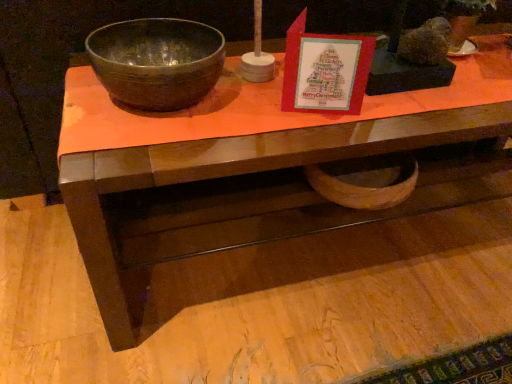
Find the location of a particular element. This screenshot has height=384, width=512. wooden desk at center is located at coordinates (249, 196).

What do you see at coordinates (249, 196) in the screenshot?
I see `wooden desk at center` at bounding box center [249, 196].

Measure the distance between point (170,71) and camera.

They are 27.24 inches apart.

Describe the element at coordinates (157, 62) in the screenshot. I see `matte brown bowl at left` at that location.

Locate an element on the screen. The width and height of the screenshot is (512, 384). matte brown bowl at left is located at coordinates (157, 62).

Locate an element on the screen. This screenshot has height=384, width=512. wooden desk at center is located at coordinates (249, 196).

Can you confirm if wooden desk at center is positioned to the right of matte brown bowl at left?

Yes.

Which object is closer to the camera taking this photo, wooden desk at center or matte brown bowl at left?

Positioned in front is wooden desk at center.

Considering the positions of point (124, 169) and point (215, 35), is point (124, 169) closer or farther from the camera than point (215, 35)?

Clearly, point (124, 169) is closer to the camera than point (215, 35).

From the image's perspective, who appears lower, wooden desk at center or matte brown bowl at left?

wooden desk at center, from the image's perspective.

From a real-world perspective, which object rests below the other?

wooden desk at center, from a real-world perspective.

Considering the relative sizes of wooden desk at center and matte brown bowl at left in the image provided, is wooden desk at center wider than matte brown bowl at left?

Yes, wooden desk at center is wider than matte brown bowl at left.

Considering the sizes of wooden desk at center and matte brown bowl at left in the image, is wooden desk at center taller or shorter than matte brown bowl at left?

In the image, wooden desk at center appears to be taller than matte brown bowl at left.

Who is bigger, wooden desk at center or matte brown bowl at left?

Bigger between the two is wooden desk at center.

Would you say wooden desk at center contains matte brown bowl at left?

That's incorrect, matte brown bowl at left is not inside wooden desk at center.

Are wooden desk at center and matte brown bowl at left far apart?

No.

Looking at this image, is wooden desk at center positioned with its back to matte brown bowl at left?

wooden desk at center does not have its back to matte brown bowl at left.

How much distance is there between wooden desk at center and matte brown bowl at left?

wooden desk at center is 11.88 inches from matte brown bowl at left.

At what (x,y) coordinates should I click in order to perform the action: click on bowl behind the wooden desk at center. Please return your answer as a coordinate pair (x, y). Looking at the image, I should click on (157, 62).

Is matte brown bowl at left at the left side of wooden desk at center?

Yes.

Who is more distant, matte brown bowl at left or wooden desk at center?

matte brown bowl at left is further away from the camera.

Which is closer to the camera, (218, 51) or (218, 152)?

The point (218, 152) is in front.

From the image's perspective, is matte brown bowl at left under wooden desk at center?

Actually, matte brown bowl at left appears above wooden desk at center in the image.

From a real-world perspective, which is physically below, matte brown bowl at left or wooden desk at center?

wooden desk at center is physically lower.

Is matte brown bowl at left wider or thinner than wooden desk at center?

Clearly, matte brown bowl at left has less width compared to wooden desk at center.

Considering the sizes of objects matte brown bowl at left and wooden desk at center in the image provided, who is shorter, matte brown bowl at left or wooden desk at center?

matte brown bowl at left is shorter.

Between matte brown bowl at left and wooden desk at center, which one has smaller size?

matte brown bowl at left.

Is matte brown bowl at left situated inside wooden desk at center or outside?

matte brown bowl at left is not inside wooden desk at center, it's outside.

Are matte brown bowl at left and wooden desk at center beside each other?

No.

Is matte brown bowl at left facing away from wooden desk at center?

No, matte brown bowl at left is not facing away from wooden desk at center.

Can you tell me how much matte brown bowl at left and wooden desk at center differ in facing direction?

The angular difference between matte brown bowl at left and wooden desk at center is 1.05 degrees.

Where is `bowl lying above the wooden desk at center (from the image's perspective)`? The width and height of the screenshot is (512, 384). bowl lying above the wooden desk at center (from the image's perspective) is located at coordinates (157, 62).

Locate an element on the screen. The height and width of the screenshot is (384, 512). bowl on the left of wooden desk at center is located at coordinates click(x=157, y=62).

Locate an element on the screen. This screenshot has width=512, height=384. desk on the right of matte brown bowl at left is located at coordinates (249, 196).